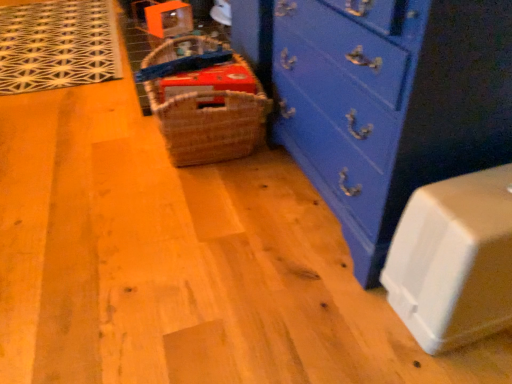
Question: Is woven brown basket at center shorter than blue painted wood chest of drawers at center?

Choices:
 (A) no
 (B) yes

Answer: (B)

Question: From a real-world perspective, is woven brown basket at center over blue painted wood chest of drawers at center?

Choices:
 (A) no
 (B) yes

Answer: (A)

Question: Does woven brown basket at center have a greater width compared to blue painted wood chest of drawers at center?

Choices:
 (A) yes
 (B) no

Answer: (A)

Question: Would you consider woven brown basket at center to be distant from blue painted wood chest of drawers at center?

Choices:
 (A) no
 (B) yes

Answer: (A)

Question: Can you confirm if woven brown basket at center is positioned to the right of blue painted wood chest of drawers at center?

Choices:
 (A) yes
 (B) no

Answer: (B)

Question: Considering the positions of white plastic container at lower right and woven brown basket at center in the image, is white plastic container at lower right wider or thinner than woven brown basket at center?

Choices:
 (A) thin
 (B) wide

Answer: (A)

Question: Does point (452, 190) appear closer or farther from the camera than point (184, 132)?

Choices:
 (A) closer
 (B) farther

Answer: (A)

Question: Based on their sizes in the image, would you say white plastic container at lower right is bigger or smaller than woven brown basket at center?

Choices:
 (A) small
 (B) big

Answer: (A)

Question: Is white plastic container at lower right taller or shorter than woven brown basket at center?

Choices:
 (A) tall
 (B) short

Answer: (A)

Question: From a real-world perspective, is white plastic container at lower right physically located above or below blue painted wood chest of drawers at center?

Choices:
 (A) below
 (B) above

Answer: (A)

Question: Considering the positions of white plastic container at lower right and blue painted wood chest of drawers at center in the image, is white plastic container at lower right taller or shorter than blue painted wood chest of drawers at center?

Choices:
 (A) short
 (B) tall

Answer: (A)

Question: Does point (426, 344) appear closer or farther from the camera than point (410, 160)?

Choices:
 (A) closer
 (B) farther

Answer: (B)

Question: Is white plastic container at lower right wider or thinner than blue painted wood chest of drawers at center?

Choices:
 (A) wide
 (B) thin

Answer: (B)

Question: Is blue painted wood chest of drawers at center wider or thinner than white plastic container at lower right?

Choices:
 (A) thin
 (B) wide

Answer: (B)

Question: In the image, is blue painted wood chest of drawers at center positioned in front of or behind white plastic container at lower right?

Choices:
 (A) front
 (B) behind

Answer: (B)